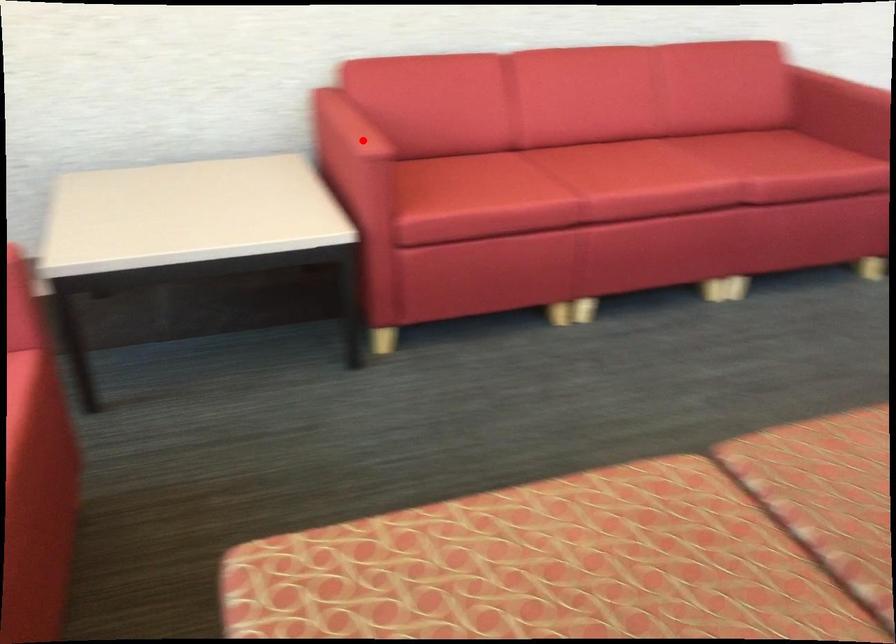
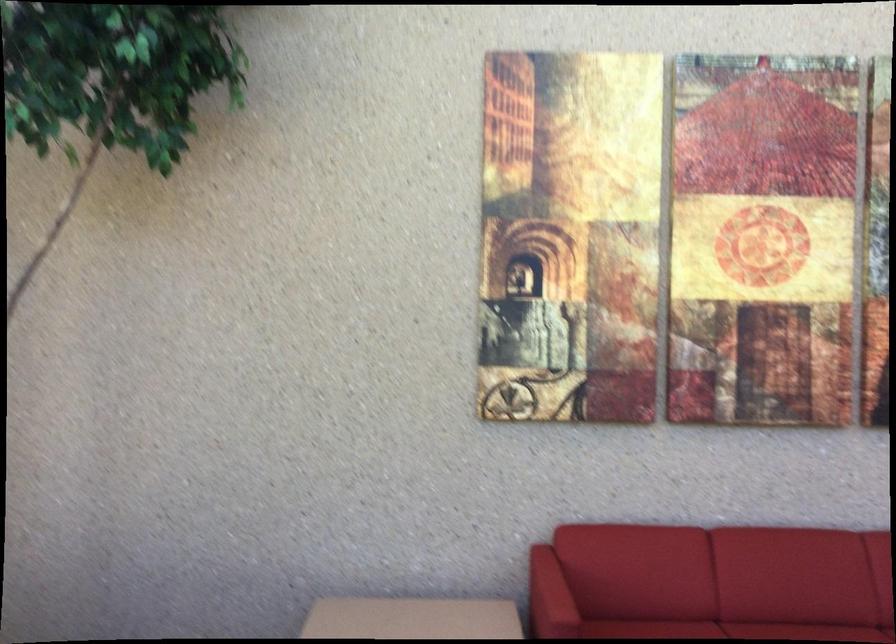
Question: I am providing you with two images of the same scene from different viewpoints. Image1 has a red point marked. In image2, the corresponding 3D location appears at what relative position? Reply with the corresponding letter.

Choices:
 (A) Closer
 (B) Farther

Answer: (B)